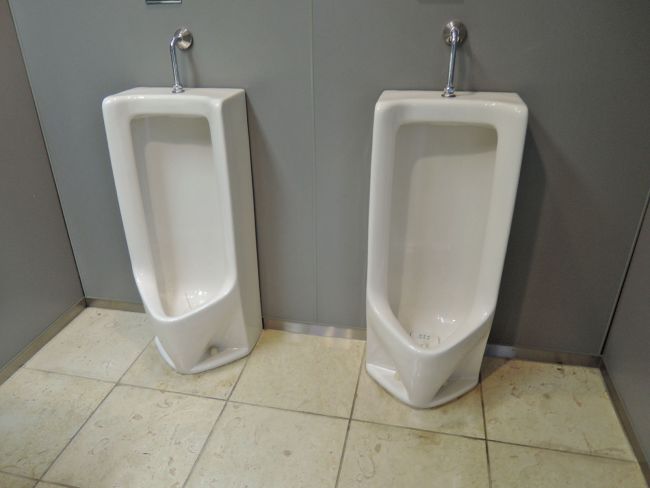
This screenshot has height=488, width=650. In order to click on wall in this screenshot , I will do `click(32, 209)`.